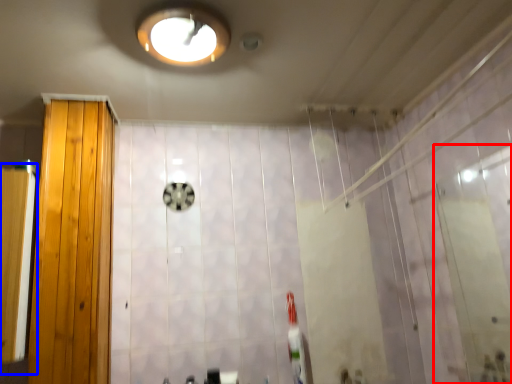
Question: Which point is further to the camera, screen door (highlighted by a red box) or screen door (highlighted by a blue box)?

Choices:
 (A) screen door
 (B) screen door

Answer: (B)